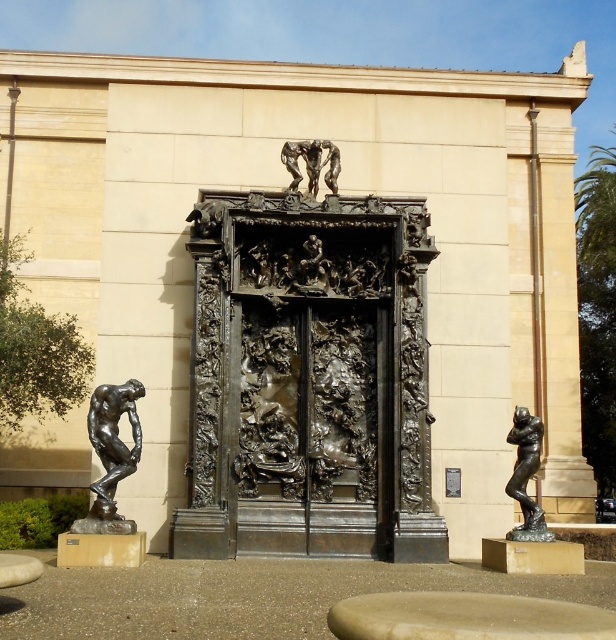
You are standing in front of the monumental bronze sculpture. You want to take a photo of the point at coordinates point (517, 468). If your camera has a maximum focus range of 60 meters, will you be able to focus on it?

The point (517, 468) is 59.68 meters from the camera, so yes, the camera can focus on it since it is within the 60 meter range.